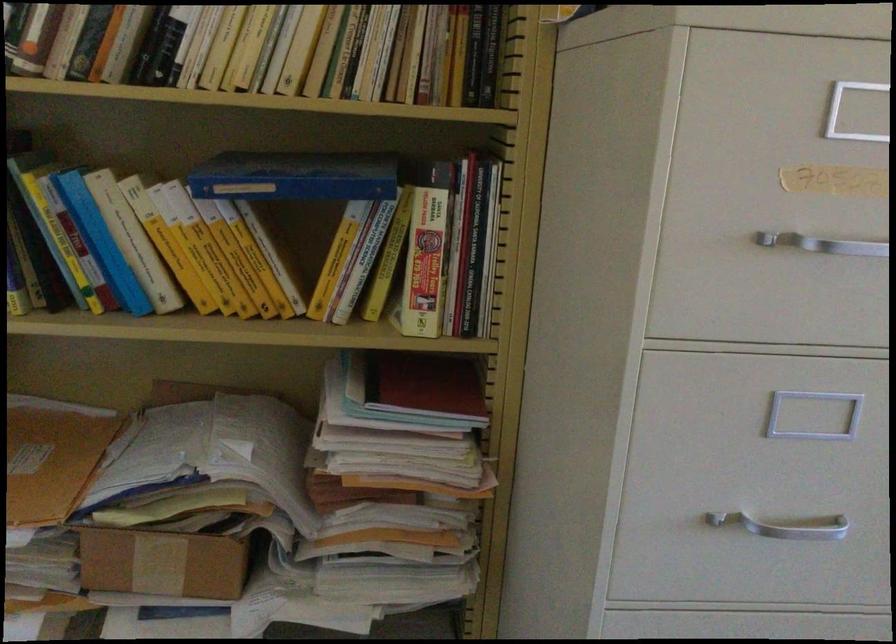
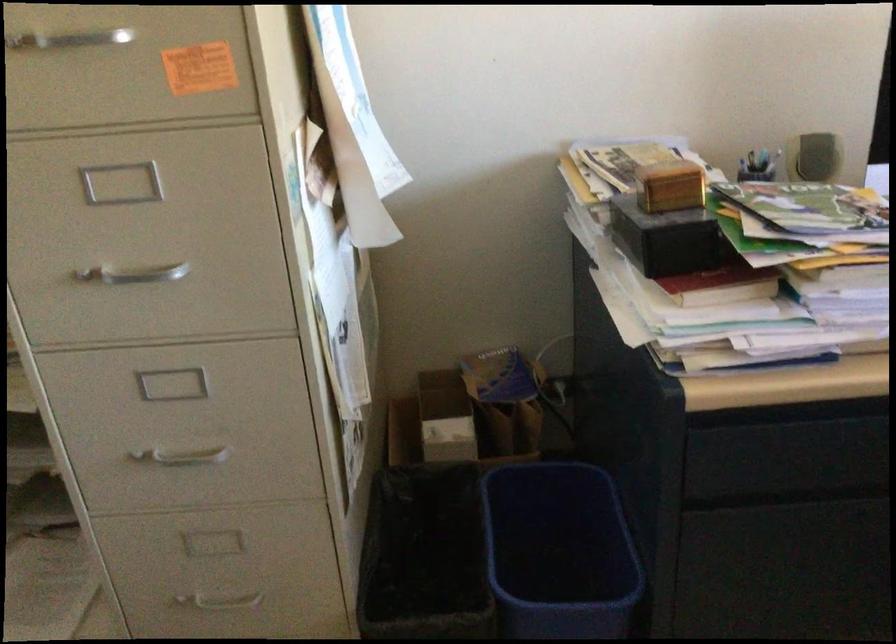
Question: What movement of the cameraman would produce the second image?

Choices:
 (A) Left
 (B) Right
 (C) Forward
 (D) Backward

Answer: (B)